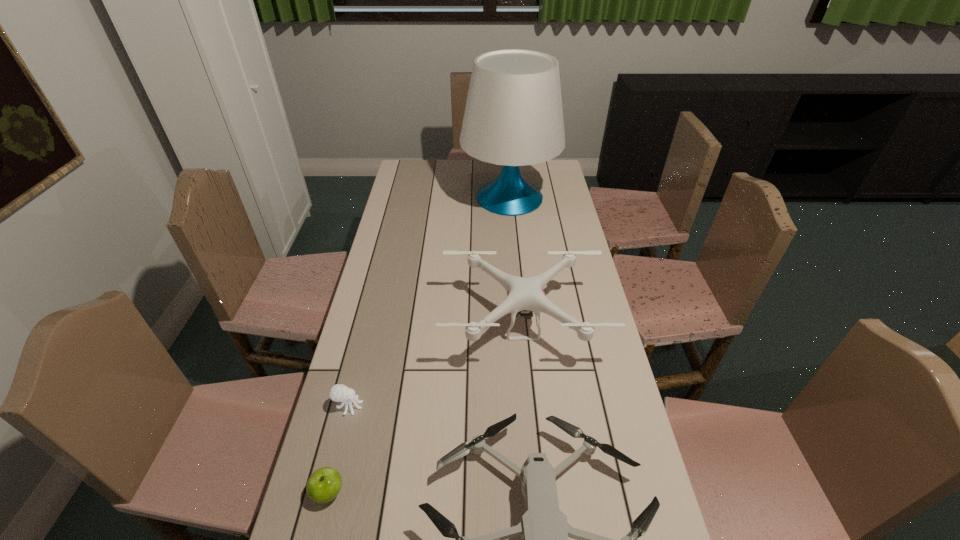
In the image, there is a desktop. Identify the location of free space at the right edge. (615, 515).

Where is `empty space that is in between the third nearest object and the fourth shortest object`? The image size is (960, 540). empty space that is in between the third nearest object and the fourth shortest object is located at coordinates (436, 366).

Where is `free space between the taller drone and the third farthest object`? The height and width of the screenshot is (540, 960). free space between the taller drone and the third farthest object is located at coordinates (436, 366).

Locate an element on the screen. The width and height of the screenshot is (960, 540). vacant area that lies between the octopus and the tallest object is located at coordinates (429, 302).

The image size is (960, 540). I want to click on blank region between the octopus and the fourth shortest object, so click(x=436, y=366).

Image resolution: width=960 pixels, height=540 pixels. I want to click on free space between the fourth nearest object and the table lamp, so click(x=516, y=262).

Locate an element on the screen. This screenshot has height=540, width=960. free space between the apple and the third farthest object is located at coordinates (339, 449).

Locate an element on the screen. The width and height of the screenshot is (960, 540). free spot between the octopus and the apple is located at coordinates (339, 449).

This screenshot has width=960, height=540. Identify the location of object that is the second closest to the nearer drone. (324, 484).

This screenshot has width=960, height=540. I want to click on the fourth closest object to the third shortest object, so click(513, 117).